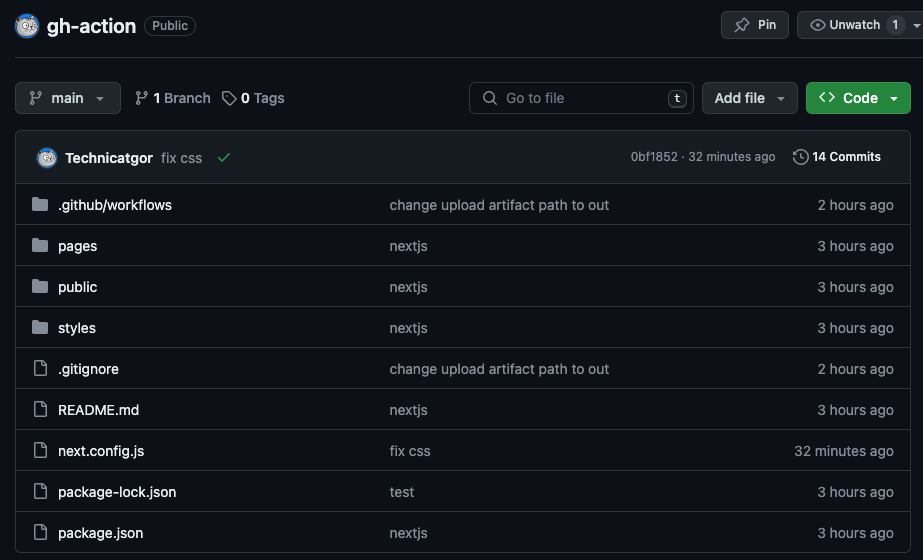
The width and height of the screenshot is (923, 560). In order to click on files in this screenshot , I will do point(42,363), point(36,401), point(39,449), point(39,492), point(34,533).